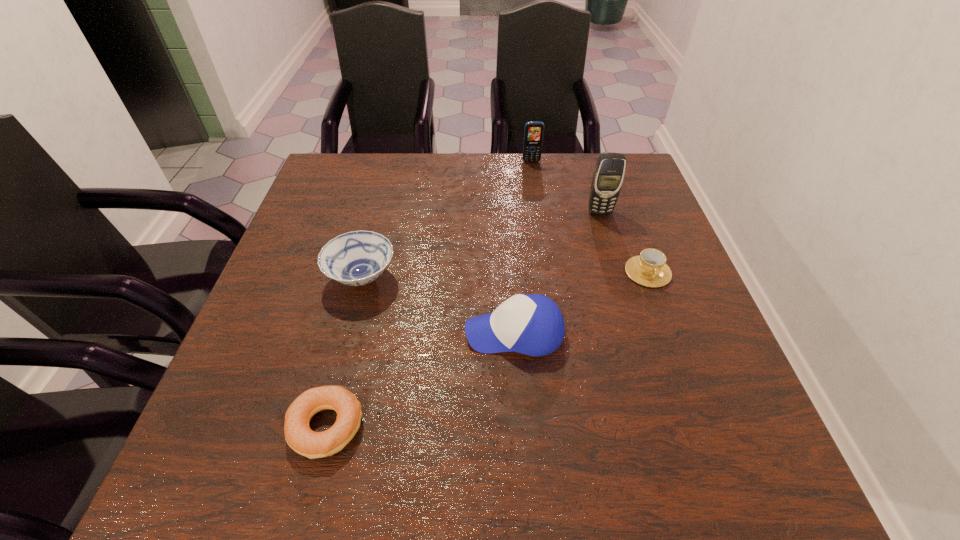
Find the location of a particular element. This screenshot has width=960, height=540. cellular telephone situated at the right edge is located at coordinates (608, 176).

Find the location of a particular element. This screenshot has height=540, width=960. cup present at the right edge is located at coordinates (649, 269).

You are a GUI agent. You are given a task and a screenshot of the screen. Output one action in this format:
    pyautogui.click(x=<x>, y=<y>)
    Task: Click on the object that is positioned at the near left corner
    
    Given the screenshot: What is the action you would take?
    pyautogui.click(x=298, y=435)

The height and width of the screenshot is (540, 960). Find the location of `free spot at the far edge of the desktop`. free spot at the far edge of the desktop is located at coordinates (457, 169).

At what (x,y) coordinates should I click in order to perform the action: click on free space at the near edge of the desktop. Please return your answer as a coordinate pair (x, y). The image size is (960, 540). Looking at the image, I should click on click(x=437, y=451).

This screenshot has width=960, height=540. What are the coordinates of `free space at the left edge` in the screenshot? It's located at (327, 317).

In the image, there is a desktop. Where is `free region at the right edge`? Image resolution: width=960 pixels, height=540 pixels. free region at the right edge is located at coordinates (678, 258).

Find the location of `free space at the near left corner of the desktop`. free space at the near left corner of the desktop is located at coordinates (192, 488).

The image size is (960, 540). I want to click on free space at the far right corner of the desktop, so click(626, 181).

What are the coordinates of `vacant space at the near right corner` in the screenshot? It's located at (756, 461).